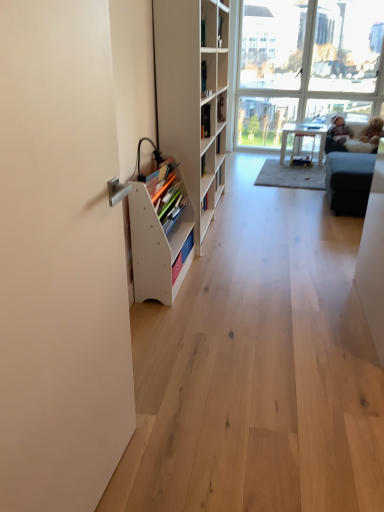
Consider the image. What is the approximate height of white matte screen door at left?

white matte screen door at left is 1.47 meters in height.

What do you see at coordinates (307, 59) in the screenshot? I see `transparent glass window at upper right` at bounding box center [307, 59].

Image resolution: width=384 pixels, height=512 pixels. What do you see at coordinates (303, 136) in the screenshot?
I see `white glossy table at center` at bounding box center [303, 136].

Where is `white glossy table at center`? Image resolution: width=384 pixels, height=512 pixels. white glossy table at center is located at coordinates (303, 136).

This screenshot has height=512, width=384. Find the location of `white matte screen door at left`. white matte screen door at left is located at coordinates (60, 259).

Is light brown plush toy at upper right positioned behind transparent glass window at upper right?

Yes, light brown plush toy at upper right is further from the viewer.

Is light brown plush toy at upper right smaller than transparent glass window at upper right?

Yes.

Is light brown plush toy at upper right positioned beyond the bounds of transparent glass window at upper right?

Yes, light brown plush toy at upper right is not within transparent glass window at upper right.

Between light brown plush toy at upper right and transparent glass window at upper right, which one has more height?

transparent glass window at upper right.

Is dark gray fabric couch at upper right to the right of white matte screen door at left from the viewer's perspective?

Indeed, dark gray fabric couch at upper right is positioned on the right side of white matte screen door at left.

Considering the points (342, 134) and (5, 492), which point is in front, point (342, 134) or point (5, 492)?

The point (5, 492) is more forward.

From a real-world perspective, is dark gray fabric couch at upper right beneath white matte screen door at left?

Indeed, from a real-world perspective, dark gray fabric couch at upper right is positioned beneath white matte screen door at left.

In the scene shown: Is dark gray fabric couch at upper right positioned in front of white matte screen door at left?

No, dark gray fabric couch at upper right is further to the viewer.

From a real-world perspective, does hardcover book at upper center, acting as the first book starting from the back, sit lower than white matte screen door at left?

Incorrect, from a real-world perspective, hardcover book at upper center, acting as the first book starting from the back, is higher than white matte screen door at left.

Which of these two, hardcover book at upper center, the 1th book when ordered from top to bottom, or white matte screen door at left, is bigger?

With larger size is white matte screen door at left.

Is hardcover book at upper center, arranged as the second book when ordered from the bottom, directly adjacent to white matte screen door at left?

hardcover book at upper center, arranged as the second book when ordered from the bottom, is not next to white matte screen door at left, and they're not touching.

Is hardcover book at upper center, acting as the 2th book starting from the left, taller or shorter than white matte screen door at left?

In the image, hardcover book at upper center, acting as the 2th book starting from the left, appears to be shorter than white matte screen door at left.

Based on the photo, is white plastic book at left, which appears as the 1th book when viewed from the front, bigger or smaller than white matte bookshelf at left, the 1th shelf in the top-to-bottom sequence?

white plastic book at left, which appears as the 1th book when viewed from the front, is smaller than white matte bookshelf at left, the 1th shelf in the top-to-bottom sequence.

Is white plastic book at left, which ranks as the second book in right-to-left order, positioned behind white matte bookshelf at left, positioned as the 2th shelf in bottom-to-top order?

No, white plastic book at left, which ranks as the second book in right-to-left order, is closer to the viewer.

Is white plastic book at left, arranged as the 1th book when ordered from the bottom, beside white matte bookshelf at left, the 1th shelf in the top-to-bottom sequence?

No, white plastic book at left, arranged as the 1th book when ordered from the bottom, is not beside white matte bookshelf at left, the 1th shelf in the top-to-bottom sequence.

Is white matte screen door at left oriented away from white plastic book at left, arranged as the 1th book when ordered from the bottom?

No, white matte screen door at left is not facing away from white plastic book at left, arranged as the 1th book when ordered from the bottom.

Would you say white matte screen door at left is inside or outside white plastic book at left, which ranks as the second book in right-to-left order?

white matte screen door at left lies outside white plastic book at left, which ranks as the second book in right-to-left order.

Find the location of a particular element. The image size is (384, 512). screen door that is in front of the white plastic book at left, acting as the 1th book starting from the left is located at coordinates (60, 259).

Does white matte screen door at left have a greater height compared to white plastic book at left, the 2th book in the back-to-front sequence?

Correct, white matte screen door at left is much taller as white plastic book at left, the 2th book in the back-to-front sequence.

Find the location of a particular element. the 1st shelf below when counting from the dark gray fabric couch at upper right (from the image's perspective) is located at coordinates (193, 98).

Is white matte bookshelf at left, positioned as the 2th shelf in bottom-to-top order, taller or shorter than dark gray fabric couch at upper right?

In the image, white matte bookshelf at left, positioned as the 2th shelf in bottom-to-top order, appears to be taller than dark gray fabric couch at upper right.

Is there a large distance between white matte bookshelf at left, the 1th shelf in the top-to-bottom sequence, and dark gray fabric couch at upper right?

Indeed, white matte bookshelf at left, the 1th shelf in the top-to-bottom sequence, is not near dark gray fabric couch at upper right.

What's the angular difference between white matte bookshelf at left, positioned as the 2th shelf in bottom-to-top order, and dark gray fabric couch at upper right's facing directions?

The angle between the facing direction of white matte bookshelf at left, positioned as the 2th shelf in bottom-to-top order, and the facing direction of dark gray fabric couch at upper right is 94.3 degrees.

Can you tell me how much white plastic book at left, arranged as the 1th book when ordered from the bottom, and dark gray fabric couch at upper right differ in facing direction?

The angle between the facing direction of white plastic book at left, arranged as the 1th book when ordered from the bottom, and the facing direction of dark gray fabric couch at upper right is 94.5 degrees.

Considering their positions, is white plastic book at left, positioned as the second book in top-to-bottom order, located in front of or behind dark gray fabric couch at upper right?

white plastic book at left, positioned as the second book in top-to-bottom order, is positioned closer to the viewer than dark gray fabric couch at upper right.

Can you confirm if white plastic book at left, the 2th book in the back-to-front sequence, is thinner than dark gray fabric couch at upper right?

Indeed, white plastic book at left, the 2th book in the back-to-front sequence, has a lesser width compared to dark gray fabric couch at upper right.

Locate an element on the screen. couch above the white plastic book at left, positioned as the second book in top-to-bottom order (from the image's perspective) is located at coordinates (354, 136).

The height and width of the screenshot is (512, 384). I want to click on window above the light brown plush toy at upper right (from a real-world perspective), so click(307, 59).

The width and height of the screenshot is (384, 512). I want to click on couch that is on the right side of white matte screen door at left, so click(x=354, y=136).

Based on their spatial positions, is white glossy table at center or white matte bookshelf at left, the 1th shelf in the top-to-bottom sequence, closer to white wood bookshelf at left, which is the 2th shelf in top-to-bottom order?

A: white matte bookshelf at left, the 1th shelf in the top-to-bottom sequence, is closer to white wood bookshelf at left, which is the 2th shelf in top-to-bottom order.

Considering their positions, is white wood bookshelf at left, the first shelf in the bottom-to-top sequence, positioned further to transparent glass window at upper right than white matte screen door at left?

white matte screen door at left is further to transparent glass window at upper right.

From the image, which object appears to be nearer to light brown plush toy at upper right, white matte screen door at left or white glossy table at center?

Based on the image, white glossy table at center appears to be nearer to light brown plush toy at upper right.

When comparing their distances from light brown plush toy at upper right, does white matte screen door at left or white wood bookshelf at left, which is the 2th shelf in top-to-bottom order, seem closer?

white wood bookshelf at left, which is the 2th shelf in top-to-bottom order, lies closer to light brown plush toy at upper right than the other object.

From the image, which object appears to be farther from white glossy table at center, white matte screen door at left or white matte bookshelf at left, positioned as the 2th shelf in bottom-to-top order?

Among the two, white matte screen door at left is located further to white glossy table at center.

From the image, which object appears to be farther from dark gray fabric couch at upper right, transparent glass window at upper right or hardcover book at upper center, the 1th book when ordered from top to bottom?

hardcover book at upper center, the 1th book when ordered from top to bottom.

Looking at the image, which one is located further to white matte screen door at left, white plastic book at left, which ranks as the second book in right-to-left order, or transparent glass window at upper right?

The object further to white matte screen door at left is transparent glass window at upper right.

Based on their spatial positions, is white glossy table at center or white plastic book at left, arranged as the 1th book when ordered from the bottom, closer to light brown plush toy at upper right?

white glossy table at center lies closer to light brown plush toy at upper right than the other object.

This screenshot has height=512, width=384. I want to click on person between hardcover book at upper center, the second book in the front-to-back sequence, and white glossy table at center, along the z-axis, so click(337, 135).

Where is `window between white matte bookshelf at left, the 1th shelf in the top-to-bottom sequence, and white glossy table at center in the front-back direction`? window between white matte bookshelf at left, the 1th shelf in the top-to-bottom sequence, and white glossy table at center in the front-back direction is located at coordinates (307, 59).

This screenshot has height=512, width=384. Find the location of `window located between hardcover book at upper center, the 1th book when ordered from top to bottom, and dark gray fabric couch at upper right in the left-right direction`. window located between hardcover book at upper center, the 1th book when ordered from top to bottom, and dark gray fabric couch at upper right in the left-right direction is located at coordinates (307, 59).

I want to click on window located between white plastic book at left, which appears as the 1th book when viewed from the front, and dark gray fabric couch at upper right in the depth direction, so click(307, 59).